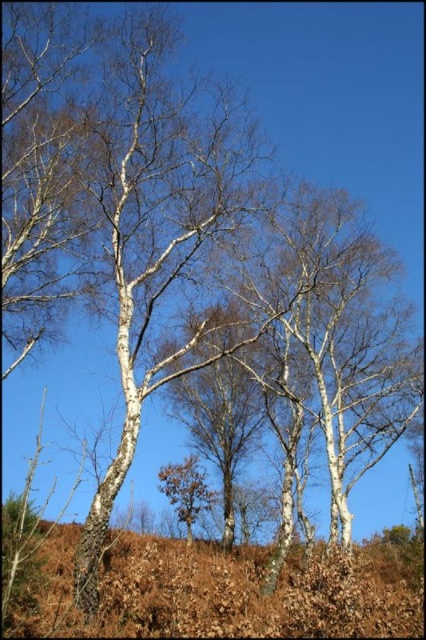
You are standing in the middle of the birch forest looking at two points marked in the image. The first point is at coordinates point (416, 632) and the second is at point (166, 470). Which point is nearer to your current position?

Point (416, 632) is closer to the camera than point (166, 470), so the first point is nearer to your current position.

You are a gardener planning to mow the area where the brown dry grass at lower center and the brown rough tree at center are located. Which object has a wider spread in terms of horizontal coverage?

The brown dry grass at lower center has a wider spread than the brown rough tree at center, as its width is larger according to the description.

You are a hiker who wants to take a photo of the brown rough tree at center. You notice the brown dry grass at lower center is blocking part of the tree. Can you determine if the grass is larger than the tree in size?

The brown dry grass at lower center is bigger than the brown rough tree at center, so yes, the grass is larger and might block the view of the tree.